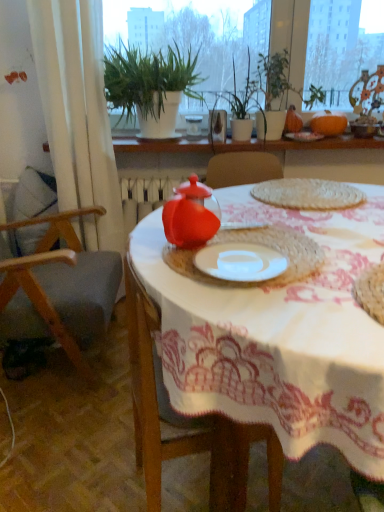
What do you see at coordinates (194, 31) in the screenshot? The image size is (384, 512). I see `green leafy plants at upper center` at bounding box center [194, 31].

Where is `orange matte pumpkin at upper right`? The height and width of the screenshot is (512, 384). orange matte pumpkin at upper right is located at coordinates (328, 123).

You are a GUI agent. You are given a task and a screenshot of the screen. Output one action in this format:
    pyautogui.click(x=<x>, y=<y>)
    Task: Click on the matte plastic teapot at center, positioned as the first tableware in front-to-back order
    
    Given the screenshot: What is the action you would take?
    [x=191, y=215]

I want to click on green leafy plants at upper center, so click(x=194, y=31).

From the image's perspective, which is above, green leafy plants at upper center or white textured plants at upper center?

green leafy plants at upper center appears higher in the image.

Is green leafy plants at upper center bigger or smaller than white textured plants at upper center?

green leafy plants at upper center is bigger than white textured plants at upper center.

From a real-world perspective, is green leafy plants at upper center located higher than white textured plants at upper center?

Yes.

Can you confirm if green leafy plants at upper center is taller than white textured plants at upper center?

Indeed, green leafy plants at upper center has a greater height compared to white textured plants at upper center.

Could green leafy plants at upper center be considered to be inside matte plastic teapot at center, which ranks as the 1th tableware in bottom-to-top order?

No, green leafy plants at upper center is located outside of matte plastic teapot at center, which ranks as the 1th tableware in bottom-to-top order.

Can you tell me how much matte plastic teapot at center, placed as the 2th tableware when sorted from right to left, and green leafy plants at upper center differ in facing direction?

The angle between the facing direction of matte plastic teapot at center, placed as the 2th tableware when sorted from right to left, and the facing direction of green leafy plants at upper center is 6.78 degrees.

Does matte plastic teapot at center, placed as the 2th tableware when sorted from right to left, have a smaller size compared to green leafy plants at upper center?

Indeed, matte plastic teapot at center, placed as the 2th tableware when sorted from right to left, has a smaller size compared to green leafy plants at upper center.

Locate an element on the screen. window screen located behind the matte plastic teapot at center, placed as the 2th tableware when sorted from right to left is located at coordinates (194, 31).

Consider the image. Is matte plastic teapot at center, which is counted as the 1th tableware, starting from the left, inside the boundaries of white fabric curtain at left, or outside?

matte plastic teapot at center, which is counted as the 1th tableware, starting from the left, is spatially situated outside white fabric curtain at left.

Considering the sizes of objects matte plastic teapot at center, which ranks as the 1th tableware in bottom-to-top order, and white fabric curtain at left in the image provided, who is wider, matte plastic teapot at center, which ranks as the 1th tableware in bottom-to-top order, or white fabric curtain at left?

Wider between the two is white fabric curtain at left.

Considering the positions of points (178, 204) and (106, 245), is point (178, 204) closer to camera compared to point (106, 245)?

Yes, point (178, 204) is closer to viewer.

What's the angular difference between matte plastic teapot at center, acting as the second tableware starting from the top, and white fabric curtain at left's facing directions?

6.47 degrees.

Which object is further away from the camera taking this photo, matte glass table at center or white fabric curtain at left?

white fabric curtain at left is more distant.

Locate an element on the screen. This screenshot has width=384, height=512. curtain located above the matte glass table at center (from the image's perspective) is located at coordinates (78, 113).

Can we say matte glass table at center lies outside white fabric curtain at left?

matte glass table at center lies outside white fabric curtain at left's area.

From a real-world perspective, which object stands above the other?

white fabric curtain at left is physically above.

From a real-world perspective, who is located higher, wooden chair at left or matte glass table at center?

matte glass table at center.

Locate an element on the screen. This screenshot has height=512, width=384. chair directly beneath the matte glass table at center (from a real-world perspective) is located at coordinates (59, 287).

Does wooden chair at left have a lesser height compared to matte glass table at center?

In fact, wooden chair at left may be taller than matte glass table at center.

Consider the image. Who is smaller, green leafy plants at upper center or green leafy plant at upper center?

green leafy plants at upper center.

Considering the sizes of objects green leafy plants at upper center and green leafy plant at upper center in the image provided, who is taller, green leafy plants at upper center or green leafy plant at upper center?

Standing taller between the two is green leafy plants at upper center.

Is green leafy plants at upper center inside or outside of green leafy plant at upper center?

green leafy plants at upper center lies outside green leafy plant at upper center.

Is point (26, 267) positioned behind point (150, 61)?

That is False.

Considering the positions of objects wooden chair at left and green leafy plant at upper center in the image provided, who is more to the right, wooden chair at left or green leafy plant at upper center?

green leafy plant at upper center.

Based on the photo, which object is wider, wooden chair at left or green leafy plant at upper center?

wooden chair at left.

From the image's perspective, would you say wooden chair at left is positioned over green leafy plant at upper center?

No, from the image's perspective, wooden chair at left is not on top of green leafy plant at upper center.

Find the location of a particular element. The image size is (384, 512). window sill behind the green leafy plants at upper center is located at coordinates (243, 145).

Where is `tableware in front of the green leafy plants at upper center`? Image resolution: width=384 pixels, height=512 pixels. tableware in front of the green leafy plants at upper center is located at coordinates (191, 215).

Estimate the real-world distances between objects in this image. Which object is closer to matte glass table at center, green leafy plants at upper center or orange matte pumpkin at upper right?

green leafy plants at upper center is closer to matte glass table at center.

Estimate the real-world distances between objects in this image. Which object is further from white matte plate at center, matte glass teapot at center, which is counted as the 1th tableware, starting from the right, or woven mat at center?

The object further to white matte plate at center is matte glass teapot at center, which is counted as the 1th tableware, starting from the right.

Which object lies further to the anchor point matte plastic teapot at center, acting as the second tableware starting from the top, white fabric curtain at left or matte glass teapot at center, which is counted as the 1th tableware, starting from the right?

Among the two, matte glass teapot at center, which is counted as the 1th tableware, starting from the right, is located further to matte plastic teapot at center, acting as the second tableware starting from the top.

Estimate the real-world distances between objects in this image. Which object is further from wooden chair at left, white fabric curtain at left or matte glass table at center?

matte glass table at center lies further to wooden chair at left than the other object.

Looking at the image, which one is located further to green leafy plant at upper center, green leafy plants at upper center or matte plastic teapot at center, positioned as the first tableware in front-to-back order?

Based on the image, matte plastic teapot at center, positioned as the first tableware in front-to-back order, appears to be further to green leafy plant at upper center.

Which object lies nearer to the anchor point white matte plate at center, green leafy plants at upper center or matte plastic teapot at center, acting as the second tableware starting from the top?

The object closer to white matte plate at center is matte plastic teapot at center, acting as the second tableware starting from the top.

From the image, which object appears to be farther from orange matte pumpkin at upper right, woven mat at center or green leafy plants at upper center?

woven mat at center lies further to orange matte pumpkin at upper right than the other object.

Considering their positions, is wooden chair at left positioned closer to orange matte pumpkin at upper right than matte plastic teapot at center, positioned as the first tableware in front-to-back order?

Among the two, matte plastic teapot at center, positioned as the first tableware in front-to-back order, is located nearer to orange matte pumpkin at upper right.

At what (x,y) coordinates should I click in order to perform the action: click on chair between matte plastic teapot at center, placed as the 2th tableware when sorted from right to left, and white fabric curtain at left in the front-back direction. Please return your answer as a coordinate pair (x, y). Image resolution: width=384 pixels, height=512 pixels. Looking at the image, I should click on (59, 287).

Where is `plant between white matte plate at center and orange matte pumpkin at upper right from front to back`? This screenshot has width=384, height=512. plant between white matte plate at center and orange matte pumpkin at upper right from front to back is located at coordinates (243, 95).

I want to click on tableware located between white fabric curtain at left and woven mat at center in the left-right direction, so click(x=191, y=215).

In order to click on houseplant located between matte glass table at center and matte glass teapot at center, which ranks as the second tableware in front-to-back order, in the depth direction in this screenshot , I will do `click(151, 86)`.